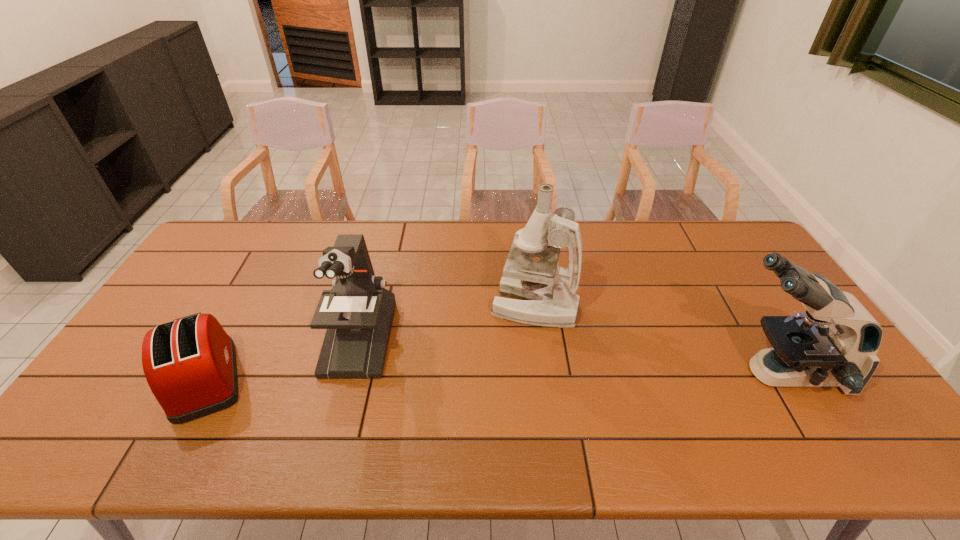
Find the location of `microscope that stands as the closest to the third object from left to right`. microscope that stands as the closest to the third object from left to right is located at coordinates (358, 312).